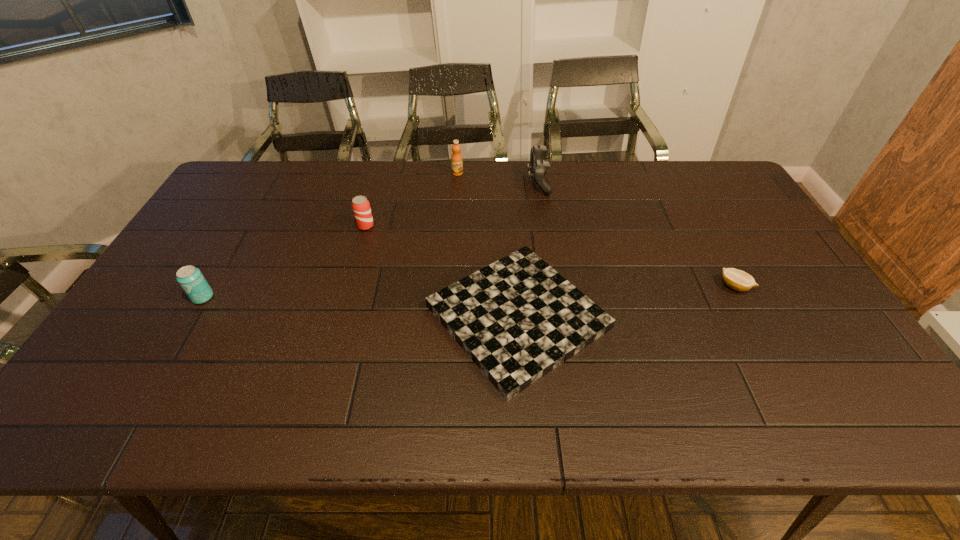
Image resolution: width=960 pixels, height=540 pixels. I want to click on object situated at the left edge, so click(x=190, y=278).

Image resolution: width=960 pixels, height=540 pixels. Find the location of `object at the right edge`. object at the right edge is located at coordinates (739, 280).

In the image, there is a desktop. Identify the location of vacant space at the far edge. The width and height of the screenshot is (960, 540). (315, 199).

Identify the location of vacant space at the left edge of the desktop. This screenshot has height=540, width=960. (250, 221).

In the image, there is a desktop. Identify the location of free space at the right edge. point(740,265).

Where is `vacant region at the far right corner of the desktop`? vacant region at the far right corner of the desktop is located at coordinates (701, 176).

Where is `blank area at the near right corner`? This screenshot has height=540, width=960. blank area at the near right corner is located at coordinates (834, 420).

I want to click on empty space that is in between the orange juice and the left beer can, so click(x=330, y=235).

You are a GUI agent. You are given a task and a screenshot of the screen. Output one action in this format:
    pyautogui.click(x=<x>, y=<y>)
    Task: Click on the empty location between the second shortest object and the orange juice
    
    Given the screenshot: What is the action you would take?
    pyautogui.click(x=596, y=230)

Locate an element on the screen. This screenshot has height=540, width=960. unoccupied area between the leftmost object and the shortest object is located at coordinates (360, 307).